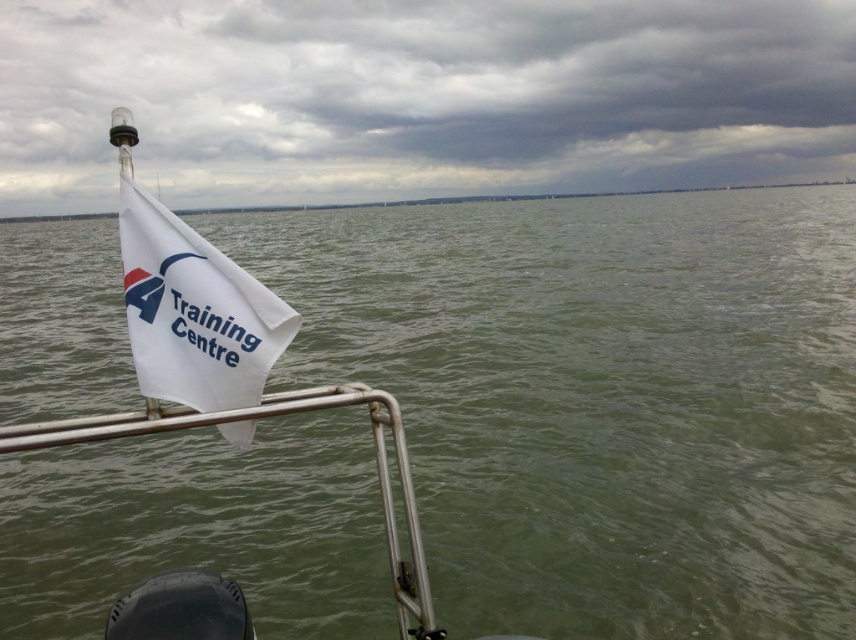
Based on the photo, you are standing on the boat deck and want to look at the green water at center. Which direction should you move to see it better, away from or closer to the white flag at left?

The green water at center is located below the white flag at left, so moving closer to the white flag at left would allow you to look downward and see the green water at center better.

You are standing on the deck of the boat and want to look at the water. Which object, the green water at center or the white flag at left, is closer to you?

The green water at center is closer to the viewer than the white flag at left.